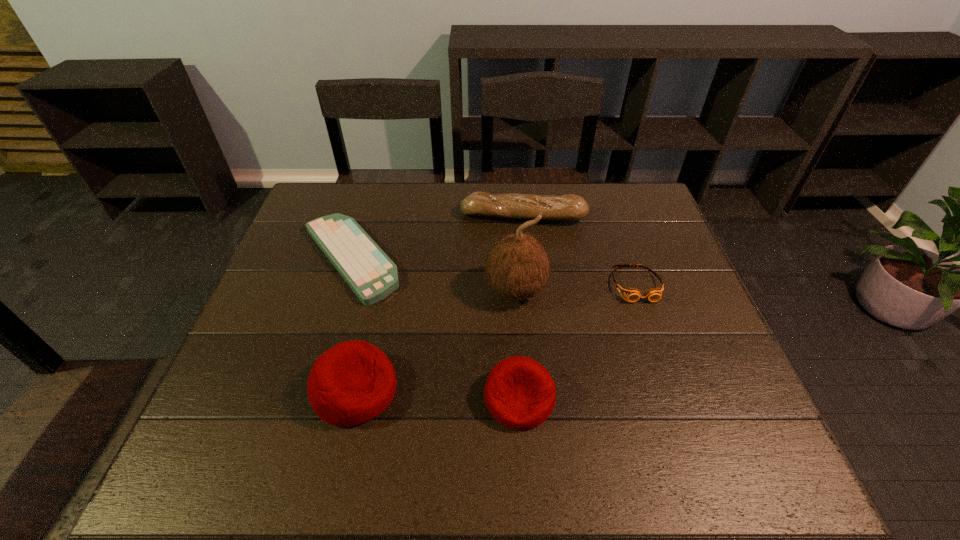
This screenshot has height=540, width=960. Find the location of `free space between the computer keyboard and the left beanbag`. free space between the computer keyboard and the left beanbag is located at coordinates (352, 324).

You are a GUI agent. You are given a task and a screenshot of the screen. Output one action in this format:
    pyautogui.click(x=<x>, y=<y>)
    Task: Click on the unoccupied area between the shorter beanbag and the goggles
    The image size is (960, 540).
    Given the screenshot: What is the action you would take?
    pyautogui.click(x=577, y=341)

The width and height of the screenshot is (960, 540). I want to click on free space between the baguet and the goggles, so click(x=579, y=251).

Identify the location of object that is the closest one to the right beanbag. Image resolution: width=960 pixels, height=540 pixels. (518, 267).

Locate an element on the screen. object that is the fifth closest one to the taller beanbag is located at coordinates (632, 294).

Find the location of `vacant space that satisfies the following two spatial constraints: 1. with the lenses facing forward on the goggles; 2. on the seat area of the taller beanbag`. vacant space that satisfies the following two spatial constraints: 1. with the lenses facing forward on the goggles; 2. on the seat area of the taller beanbag is located at coordinates (672, 390).

At what (x,y) coordinates should I click in order to perform the action: click on vacant area in the image that satisfies the following two spatial constraints: 1. with the lenses facing forward on the rightmost object; 2. on the seat area of the left beanbag. Please return your answer as a coordinate pair (x, y). The height and width of the screenshot is (540, 960). Looking at the image, I should click on (672, 390).